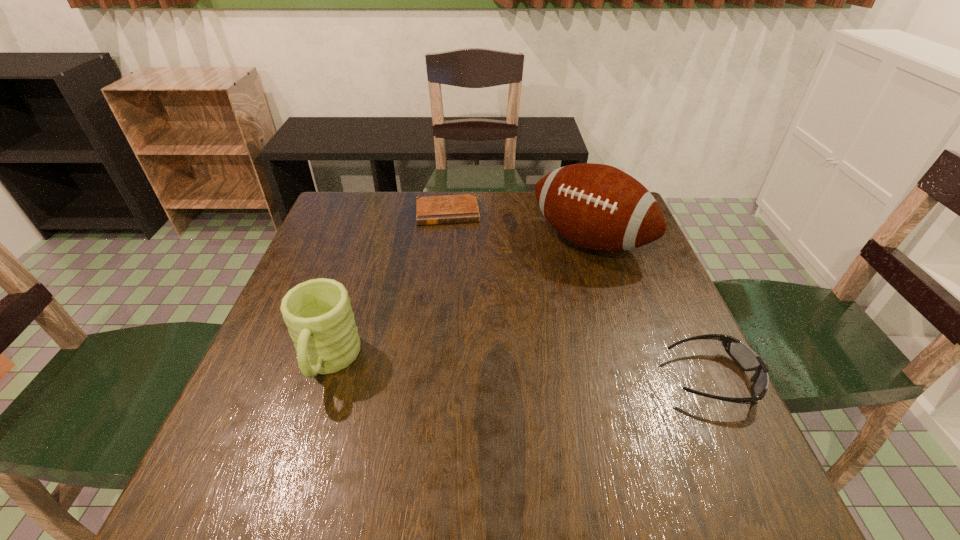
Locate an element on the screen. This screenshot has width=960, height=540. the second tallest object is located at coordinates (317, 312).

What are the coordinates of `mug` in the screenshot? It's located at (317, 312).

I want to click on the third tallest object, so click(746, 359).

The height and width of the screenshot is (540, 960). What are the coordinates of `the shortest object` in the screenshot? It's located at (453, 208).

Locate an element on the screen. diary is located at coordinates (453, 208).

The width and height of the screenshot is (960, 540). I want to click on the tallest object, so click(596, 206).

Locate an element on the screen. The image size is (960, 540). free space located on the side of the leftmost object with the handle is located at coordinates (302, 440).

Where is `vacant space located on the spine side of the second object from left to right`? The width and height of the screenshot is (960, 540). vacant space located on the spine side of the second object from left to right is located at coordinates point(452,247).

Find the location of a particular element. This screenshot has height=540, width=960. free space located 0.310m on the spine side of the second object from left to right is located at coordinates (457, 301).

Locate an element on the screen. This screenshot has height=540, width=960. vacant space located on the spine side of the second object from left to right is located at coordinates (451, 245).